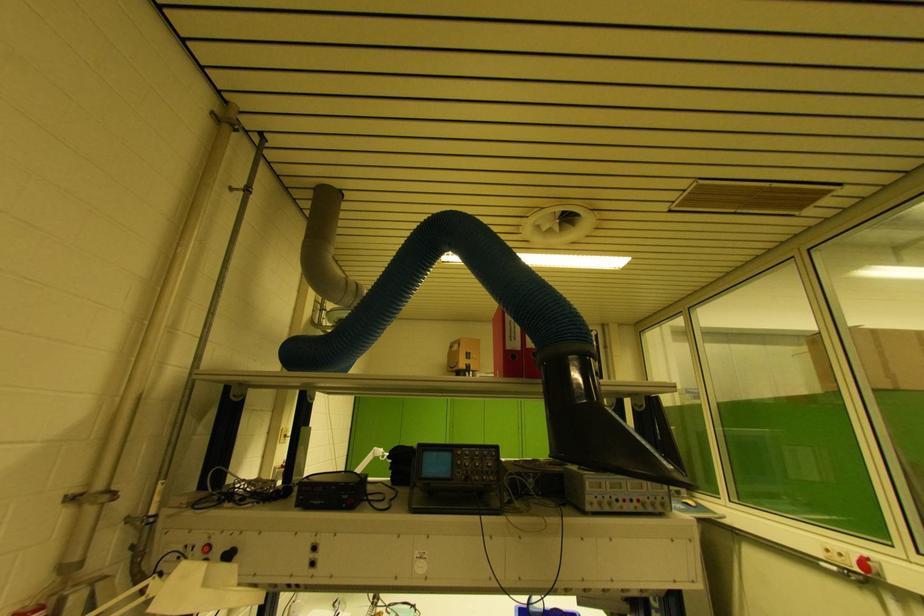
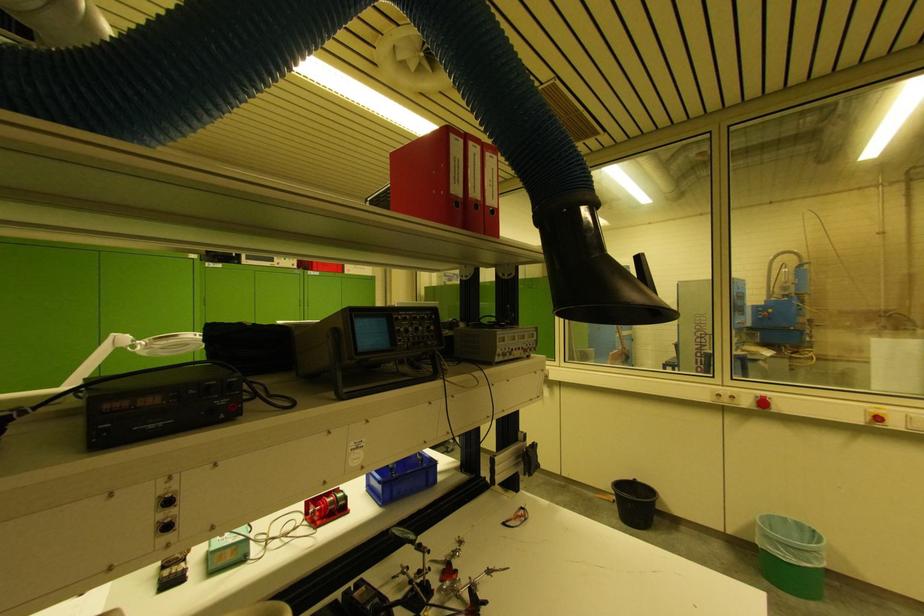
Question: Based on the continuous images, in which direction is the camera rotating? Reply with the corresponding letter.

Choices:
 (A) Left
 (B) Right
 (C) Up
 (D) Down

Answer: (B)